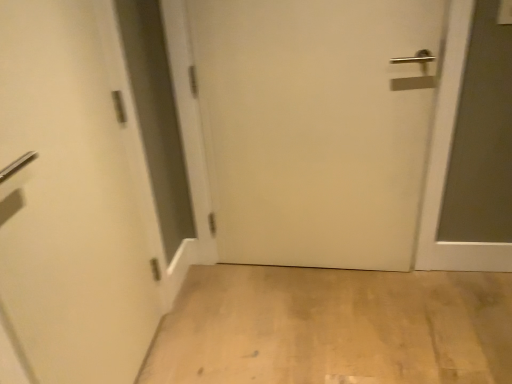
Locate an element on the screen. Image resolution: width=512 pixels, height=384 pixels. free spot below light wood floor at lower center (from a real-world perspective) is located at coordinates (342, 327).